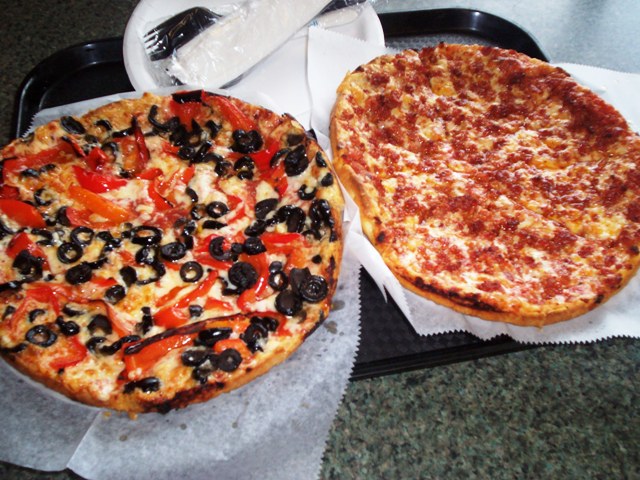
Image resolution: width=640 pixels, height=480 pixels. I want to click on fork, so click(x=168, y=20).